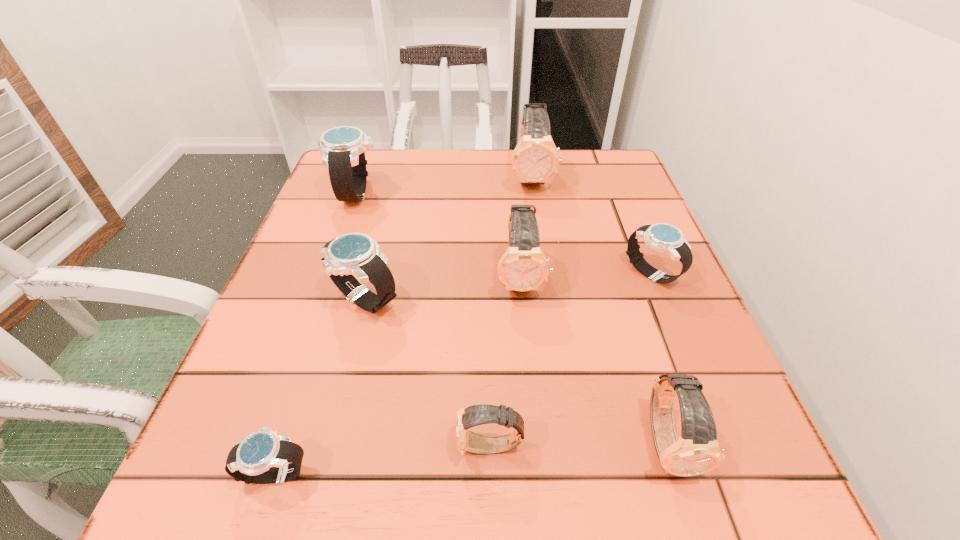
The image size is (960, 540). I want to click on the tallest watch, so click(x=535, y=159).

Locate an element on the screen. The width and height of the screenshot is (960, 540). the biggest gold watch is located at coordinates (535, 159).

In order to click on the farthest silver watch in this screenshot , I will do `click(343, 148)`.

You are a GUI agent. You are given a task and a screenshot of the screen. Output one action in this format:
    pyautogui.click(x=<x>, y=<y>)
    Task: Click on the third smallest gold watch
    The height and width of the screenshot is (540, 960).
    Given the screenshot: What is the action you would take?
    pyautogui.click(x=523, y=267)

Locate an element on the screen. This screenshot has width=960, height=540. the third smallest silver watch is located at coordinates (351, 259).

The height and width of the screenshot is (540, 960). Identify the location of the rightmost gold watch. (697, 451).

The image size is (960, 540). In order to click on the second smallest silver watch in this screenshot , I will do `click(665, 238)`.

You are a GUI agent. You are given a task and a screenshot of the screen. Output one action in this format:
    pyautogui.click(x=<x>, y=<y>)
    Task: Click on the smallest gold watch
    The height and width of the screenshot is (540, 960).
    Given the screenshot: What is the action you would take?
    pyautogui.click(x=466, y=441)

Identify the location of the smallest silver watch. The width and height of the screenshot is (960, 540). (263, 457).

Locate an element on the screen. the shortest watch is located at coordinates (263, 457).